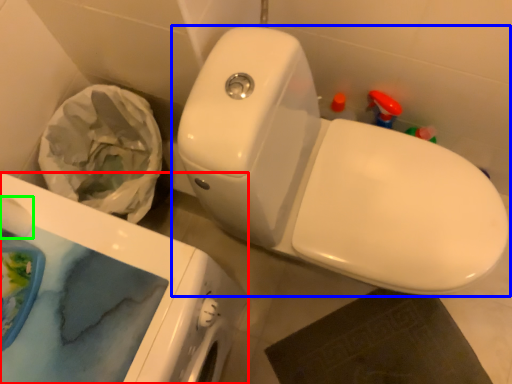
Question: Estimate the real-world distances between objects in this image. Which object is farther from porcelain (highlighted by a red box), toilet (highlighted by a blue box) or toilet paper (highlighted by a green box)?

Choices:
 (A) toilet
 (B) toilet paper

Answer: (A)